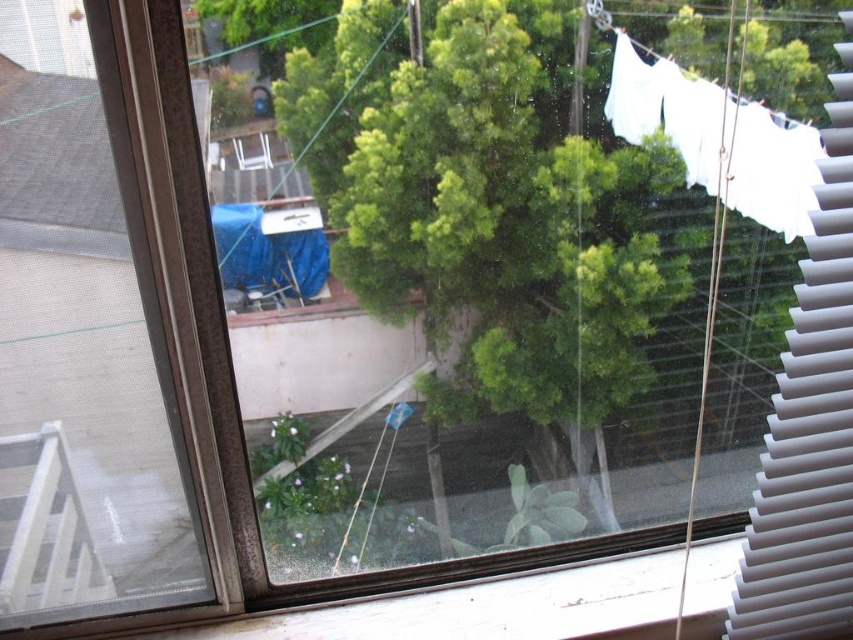
Which is in front, point (831, 572) or point (643, 120)?

Point (831, 572)

Which of these two, white plastic blinds at right or white fabric clothesline at upper right, stands shorter?

With less height is white fabric clothesline at upper right.

Between point (851, 196) and point (630, 131), which one is positioned behind?

Positioned behind is point (630, 131).

Locate an element on the screen. The height and width of the screenshot is (640, 853). white plastic blinds at right is located at coordinates (809, 426).